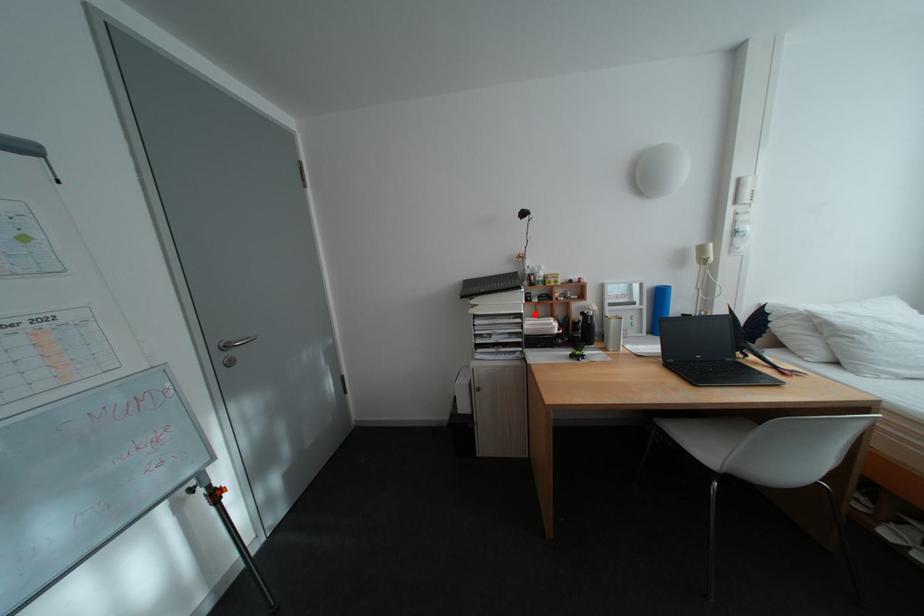
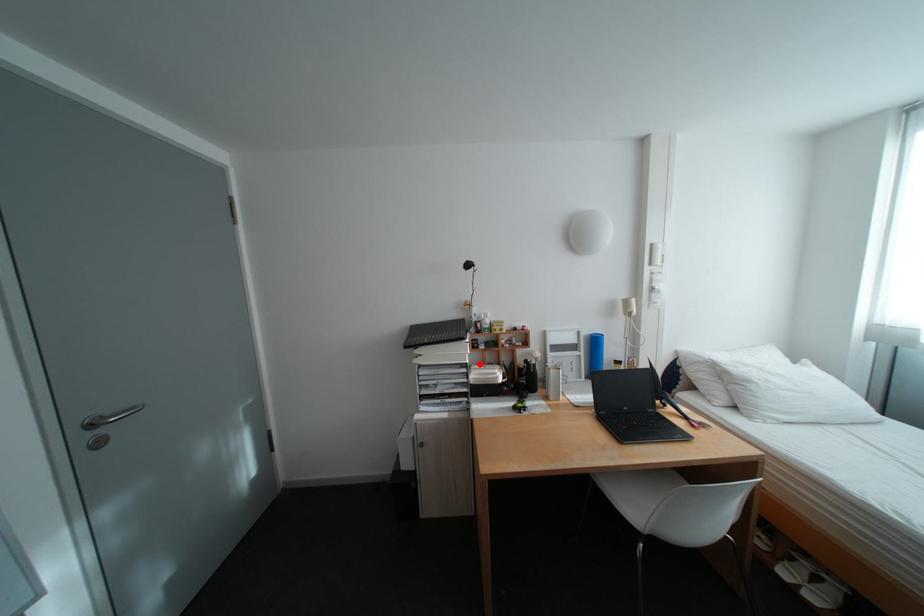
I am providing you with two images of the same scene from different viewpoints. A red point is marked on the first image and another point is marked on the second image. Is the red point in image1 aligned with the point shown in image2?

Yes